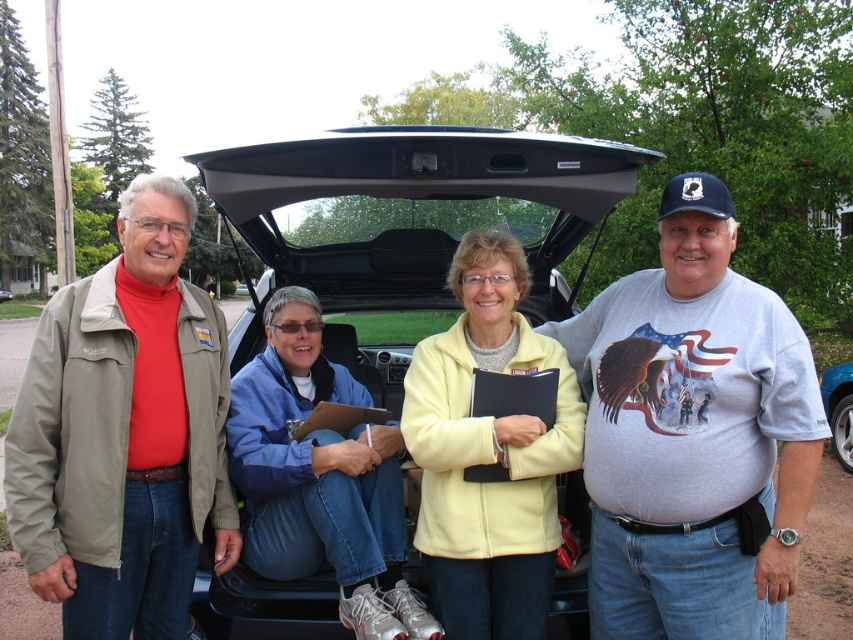
Question: From the image, what is the correct spatial relationship of gray cotton t-shirt at center in relation to matte khaki jacket at left?

Choices:
 (A) above
 (B) below

Answer: (A)

Question: Can you confirm if gray cotton t-shirt at center is positioned above matte khaki jacket at left?

Choices:
 (A) no
 (B) yes

Answer: (B)

Question: Does matte khaki jacket at left appear on the right side of blue metallic car at lower right?

Choices:
 (A) yes
 (B) no

Answer: (B)

Question: Which of these objects is positioned farthest from the blue metallic car at lower right?

Choices:
 (A) blue fleece jacket at center
 (B) yellow fleece jacket at center
 (C) matte khaki jacket at left
 (D) black plastic car trunk at center

Answer: (C)

Question: Which of the following is the closest to the observer?

Choices:
 (A) black plastic car trunk at center
 (B) gray cotton t-shirt at center
 (C) blue fleece jacket at center

Answer: (B)

Question: Which is nearer to the gray cotton t-shirt at center?

Choices:
 (A) blue fleece jacket at center
 (B) blue metallic car at lower right
 (C) yellow fleece jacket at center

Answer: (C)